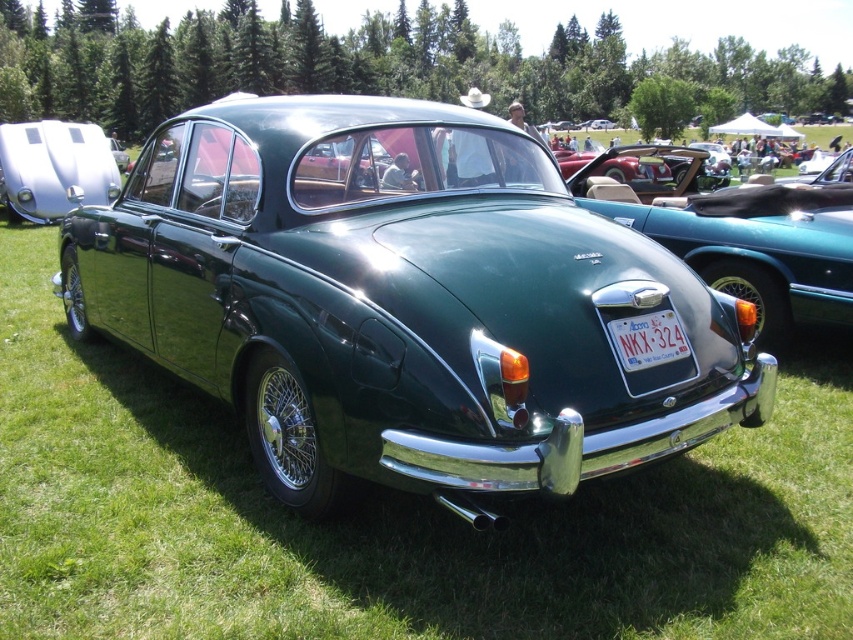
Which of these two, shiny white car at left or white plastic license plate at center, stands taller?

Standing taller between the two is shiny white car at left.

Does point (68, 164) come farther from viewer compared to point (625, 321)?

Yes, it is.

Image resolution: width=853 pixels, height=640 pixels. What are the coordinates of `shiny white car at left` in the screenshot? It's located at (54, 168).